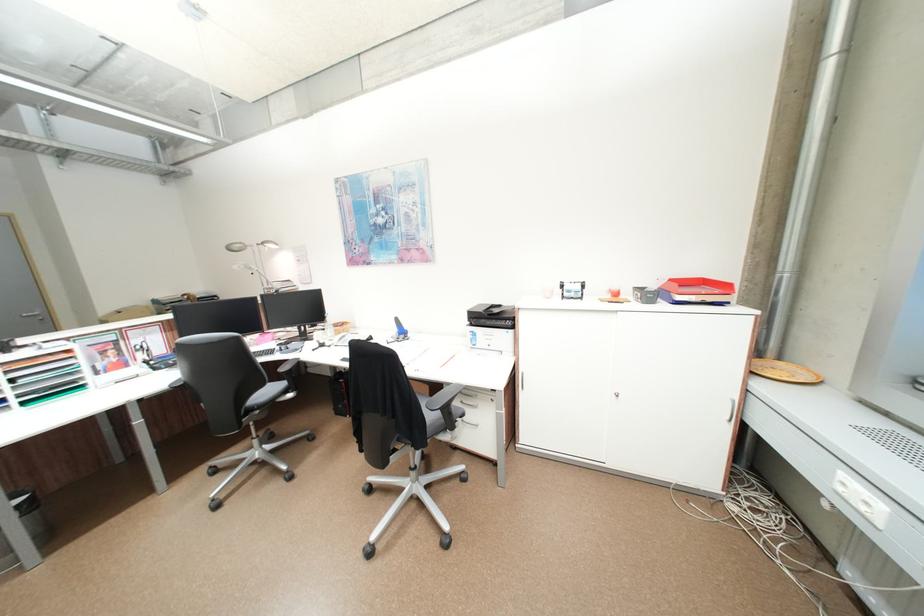
The height and width of the screenshot is (616, 924). Describe the element at coordinates (32, 315) in the screenshot. I see `the silver door handle` at that location.